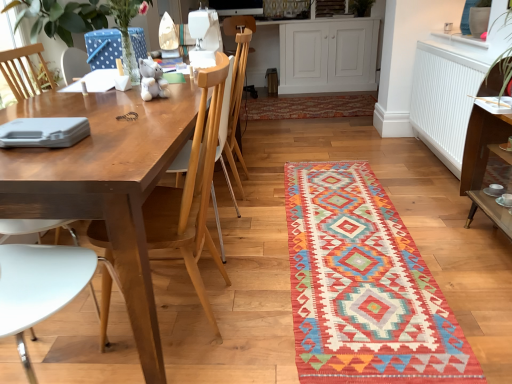
This screenshot has height=384, width=512. What are the coordinates of `free space to the left of multicolored woven mat at center` in the screenshot? It's located at (226, 253).